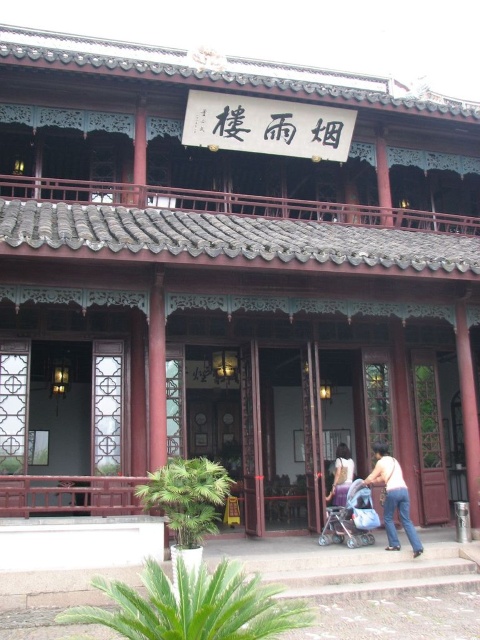
Question: Is jeans at center above blue fabric baby carriage at center?

Choices:
 (A) yes
 (B) no

Answer: (A)

Question: Which point appears farthest from the camera in this image?

Choices:
 (A) (336, 538)
 (B) (372, 449)

Answer: (B)

Question: In this image, where is jeans at center located relative to blue fabric baby carriage at center?

Choices:
 (A) above
 (B) below

Answer: (A)

Question: Is jeans at center thinner than blue fabric baby carriage at center?

Choices:
 (A) no
 (B) yes

Answer: (B)